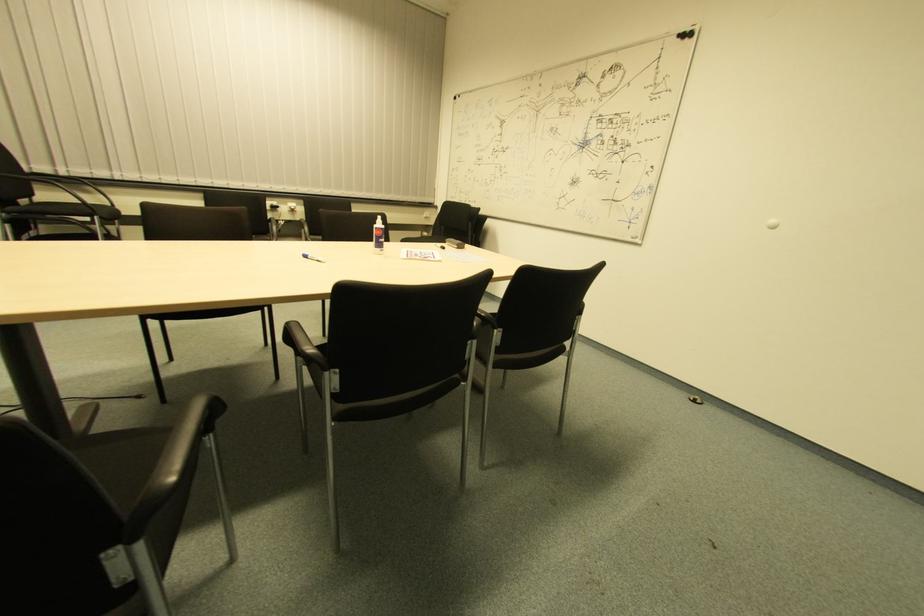
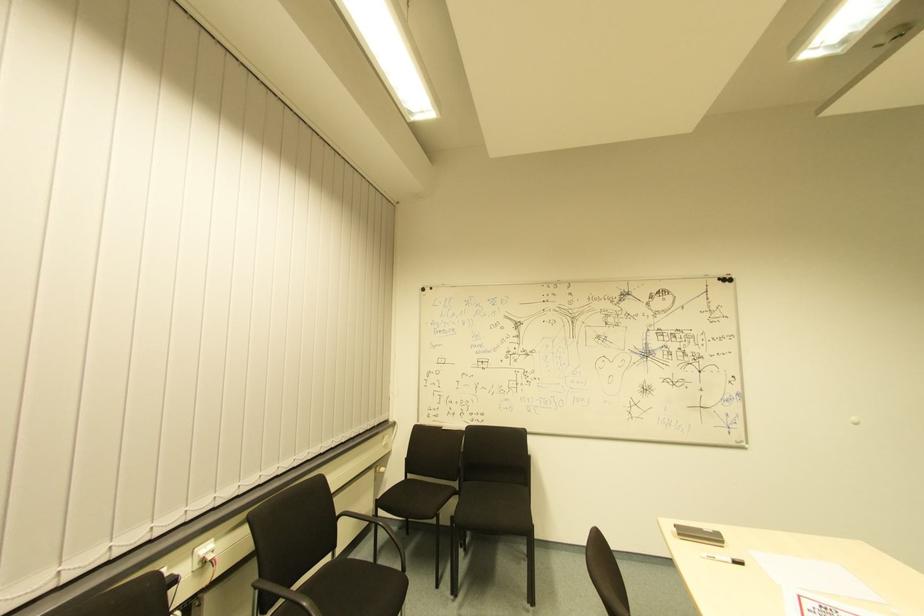
The point at (290, 211) is marked in the first image. Where is the corresponding point in the second image?

(208, 561)